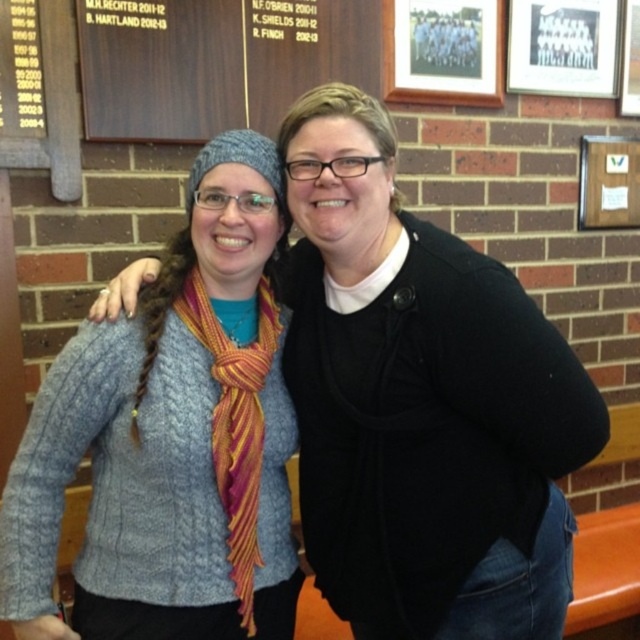
Does knitted blue sweater at center appear over knitted gray sweater at center?

Correct, knitted blue sweater at center is located above knitted gray sweater at center.

Does knitted blue sweater at center have a greater height compared to knitted gray sweater at center?

Indeed, knitted blue sweater at center has a greater height compared to knitted gray sweater at center.

You are a GUI agent. You are given a task and a screenshot of the screen. Output one action in this format:
    pyautogui.click(x=<x>, y=<y>)
    Task: Click on the knitted blue sweater at center
    The height and width of the screenshot is (640, 640).
    Given the screenshot: What is the action you would take?
    pyautogui.click(x=420, y=403)

Consider the image. Who is more distant from viewer, (378, 352) or (236, 444)?

Point (236, 444)

Is knitted blue sweater at center wider than knitted wool scarf at center?

Yes.

Is point (461, 440) farther from viewer compared to point (257, 480)?

No, it is not.

This screenshot has width=640, height=640. Identify the location of knitted blue sweater at center. (420, 403).

Measure the distance from knitted gray sweater at center to knitted wool scarf at center.

knitted gray sweater at center and knitted wool scarf at center are 8.78 centimeters apart from each other.

Describe the element at coordinates (170, 440) in the screenshot. I see `knitted gray sweater at center` at that location.

The height and width of the screenshot is (640, 640). What do you see at coordinates (170, 440) in the screenshot? I see `knitted gray sweater at center` at bounding box center [170, 440].

In order to click on knitted gray sweater at center in this screenshot , I will do `click(170, 440)`.